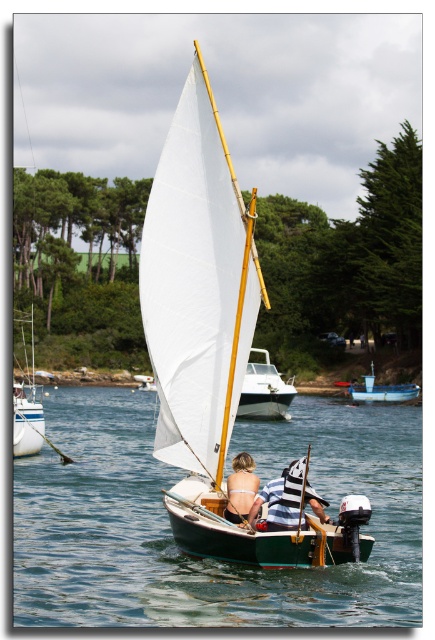
Question: Among these points, which one is nearest to the camera?

Choices:
 (A) (16, 401)
 (B) (153, 413)
 (C) (224, 509)

Answer: (C)

Question: Is clear blue water at center behind white plastic boat at left?

Choices:
 (A) no
 (B) yes

Answer: (A)

Question: Based on their relative distances, which object is nearer to the striped fabric shirt at center?

Choices:
 (A) matte white bikini top at center
 (B) white plastic boat at left
 (C) white sail at center
 (D) blue plastic boat at center

Answer: (A)

Question: Where is striped fabric shirt at center located in relation to white plastic boat at left in the image?

Choices:
 (A) left
 (B) right

Answer: (B)

Question: Which of the following is the farthest from the observer?

Choices:
 (A) (270, 496)
 (B) (414, 554)
 (C) (251, 406)
 (D) (244, 452)

Answer: (C)

Question: Is striped fabric shirt at center below white glossy sailboat at center?

Choices:
 (A) yes
 (B) no

Answer: (A)